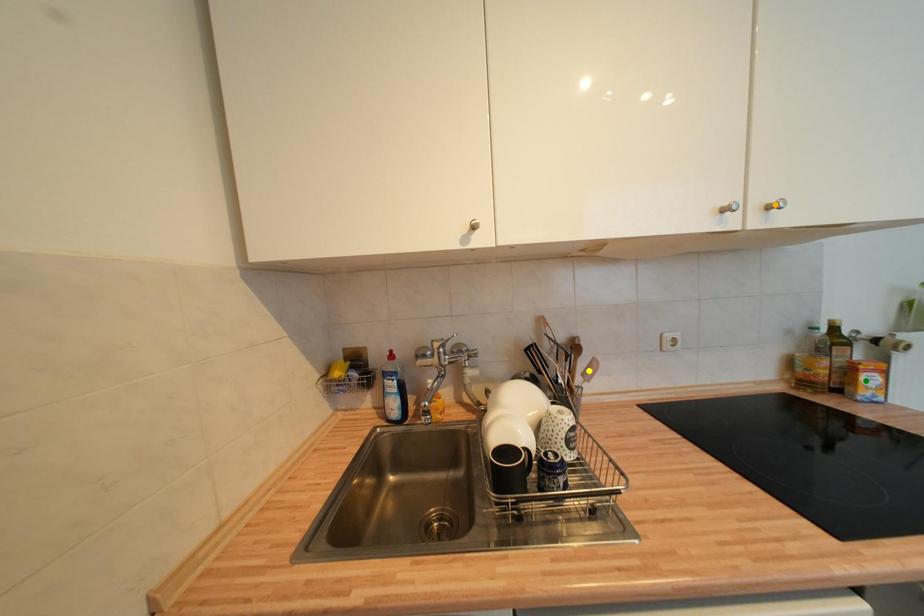
Order these from nearest to farthest:
- orange point
- green point
- yellow point

green point → yellow point → orange point